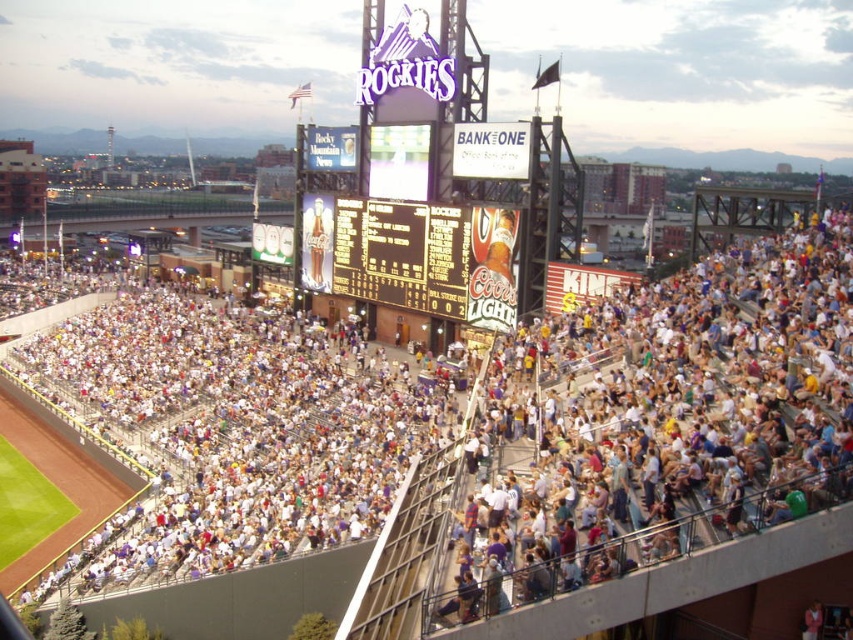
Question: Which of the following is the farthest from the observer?

Choices:
 (A) black plastic scoreboard at center
 (B) white fabric crowd at upper right
 (C) white plastic seats at center
 (D) white fabric crowd at lower left

Answer: (A)

Question: Does white fabric crowd at lower left appear under black plastic scoreboard at center?

Choices:
 (A) yes
 (B) no

Answer: (A)

Question: Can you confirm if white fabric crowd at upper right is wider than black plastic scoreboard at center?

Choices:
 (A) yes
 (B) no

Answer: (A)

Question: Estimate the real-world distances between objects in this image. Which object is closer to the white fabric crowd at lower left?

Choices:
 (A) white plastic seats at center
 (B) black plastic scoreboard at center
 (C) white fabric crowd at upper right

Answer: (A)

Question: Is white fabric crowd at upper right smaller than white fabric crowd at lower left?

Choices:
 (A) yes
 (B) no

Answer: (A)

Question: Which point is farther to the camera?

Choices:
 (A) white fabric crowd at lower left
 (B) white fabric crowd at upper right
 (C) white plastic seats at center

Answer: (A)